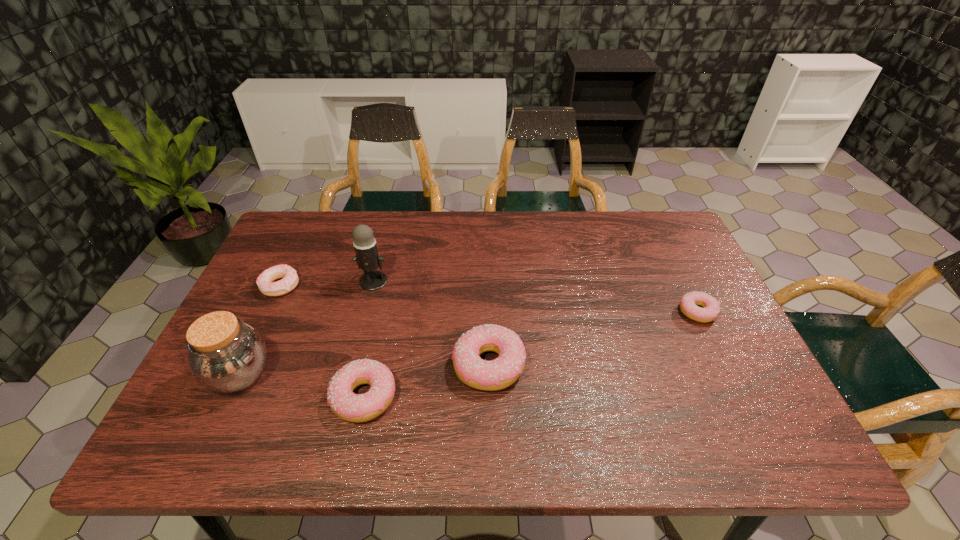
I want to click on vacant space located 0.290m on the back of the leftmost doughnut, so click(313, 215).

At what (x,y) coordinates should I click in order to perform the action: click on free space located on the front of the tallest object. Please return your answer as a coordinate pair (x, y). Looking at the image, I should click on (354, 357).

Find the location of `vacant space situated on the right of the fifth shortest object`. vacant space situated on the right of the fifth shortest object is located at coordinates tap(393, 375).

Identify the location of jar at the near edge. (226, 355).

Find the location of a particular element. The height and width of the screenshot is (540, 960). doughnut that is at the left edge is located at coordinates (265, 283).

I want to click on jar that is at the left edge, so 226,355.

I want to click on object that is at the right edge, so click(x=711, y=309).

What are the coordinates of `object located at the near left corner` in the screenshot? It's located at (226, 355).

The width and height of the screenshot is (960, 540). Identify the location of vacant space at the far edge of the desktop. (488, 226).

In the image, there is a desktop. Identify the location of free space at the near edge. This screenshot has width=960, height=540. (563, 397).